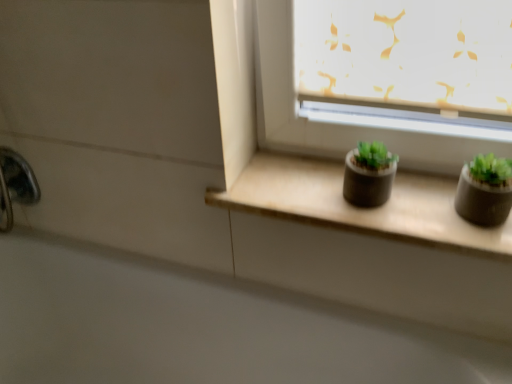
Question: From a real-world perspective, is matte black pot at center, the 1th flowerpot viewed from the left, above or below matte concrete window sill at center?

Choices:
 (A) above
 (B) below

Answer: (A)

Question: From the image's perspective, is matte black pot at center, the 1th flowerpot viewed from the left, located above or below matte concrete window sill at center?

Choices:
 (A) above
 (B) below

Answer: (A)

Question: Which object is the closest to the matte black pot at center, which is the second flowerpot from right to left?

Choices:
 (A) matte concrete window sill at center
 (B) white glossy bath at lower left
 (C) polished chrome faucet at lower left
 (D) matte gray flowerpot at right, positioned as the second flowerpot in left-to-right order

Answer: (A)

Question: Which object is the farthest from the white glossy bath at lower left?

Choices:
 (A) matte gray flowerpot at right, which ranks as the 1th flowerpot in right-to-left order
 (B) polished chrome faucet at lower left
 (C) matte black pot at center, which is the second flowerpot from right to left
 (D) matte concrete window sill at center

Answer: (A)